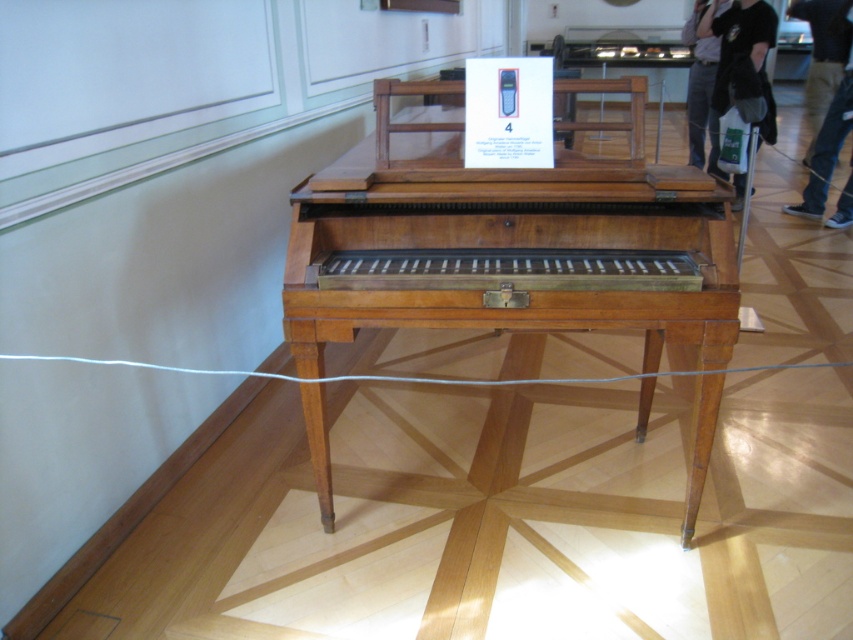
You are a security guard in the museum and notice two pairs of denim pants in the image. According to the scene, where is the brown denim pants at lower right located relative to the denim pants at right?

The brown denim pants at lower right are to the right of the denim pants at right.

You are a security guard in the museum and notice the black fabric bag at upper right and the brown denim pants at lower right. Which object is closer to the front of the museum display?

The black fabric bag at upper right is closer to the front of the museum display because the brown denim pants at lower right is behind it.